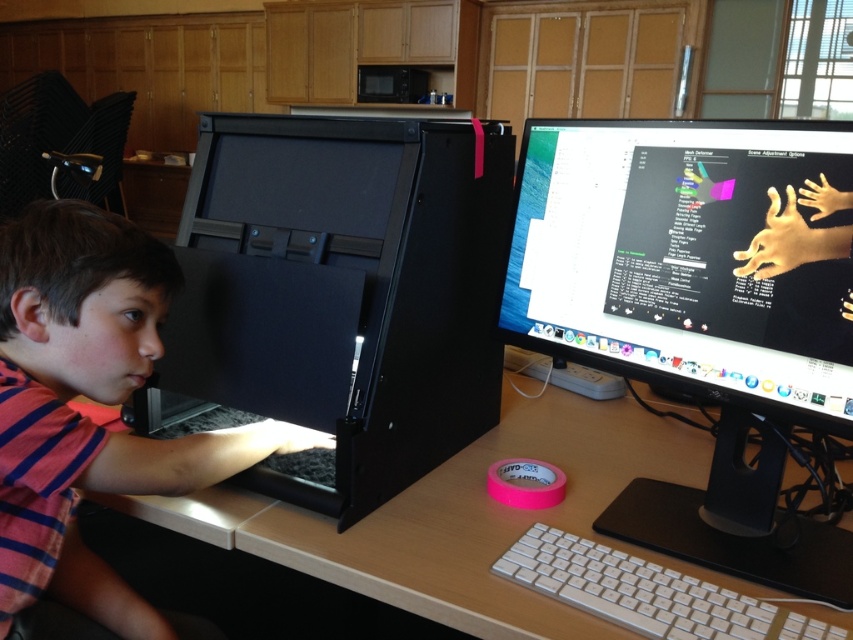
You are setting up a desk for a student who needs to place a tall lamp between the black matte computer at left and the matte black monitor at center. According to the scene, which object should the lamp be placed closer to?

The black matte computer at left is taller than the matte black monitor at center, so the lamp should be placed closer to the matte black monitor at center to avoid blocking the view.

You are a student trying to locate the exact position of the point with coordinates (700,310) in the image. Based on the scene description, where would this point be located?

The point with coordinates (700,310) is located on the black plastic monitor at center.